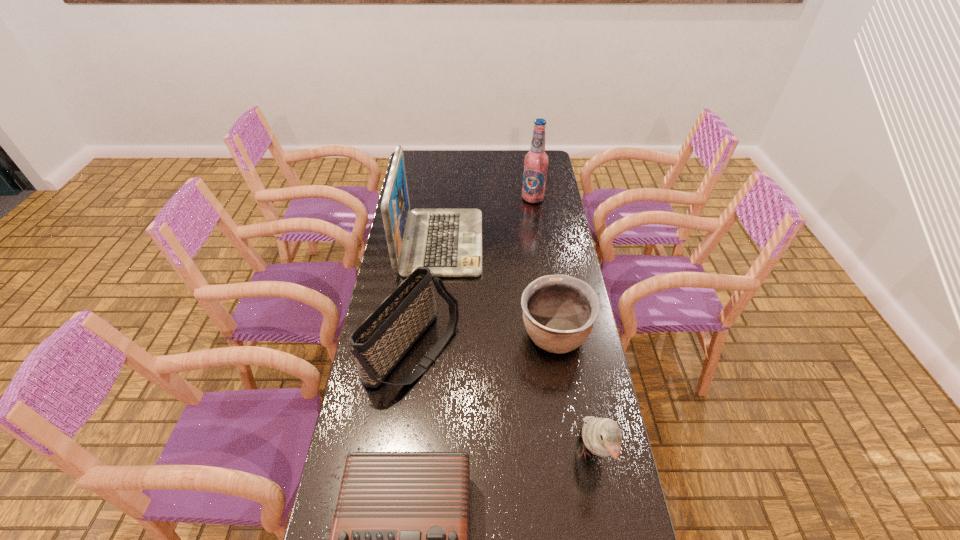
Locate an element on the screen. This screenshot has width=960, height=540. the farthest object is located at coordinates (536, 161).

I want to click on laptop computer, so click(x=448, y=241).

You are a GUI agent. You are given a task and a screenshot of the screen. Output one action in this format:
    pyautogui.click(x=<x>, y=<y>)
    Task: Click on the bird
    The width and height of the screenshot is (960, 540).
    Given the screenshot: What is the action you would take?
    pyautogui.click(x=602, y=436)

Locate an element on the screen. handbag is located at coordinates (380, 342).

Find the location of a particular element. pottery is located at coordinates click(x=559, y=311).

Identify the location of blank space located 0.400m on the front of the farthest object. The width and height of the screenshot is (960, 540). (542, 267).

The width and height of the screenshot is (960, 540). I want to click on vacant space situated 0.310m on the screen of the second farthest object, so click(558, 243).

The width and height of the screenshot is (960, 540). Identify the location of blank space located on the right of the handbag. (515, 352).

I want to click on vacant space located on the left of the pottery, so coord(406,336).

The width and height of the screenshot is (960, 540). In order to click on laptop computer located in the left edge section of the desktop in this screenshot , I will do `click(448, 241)`.